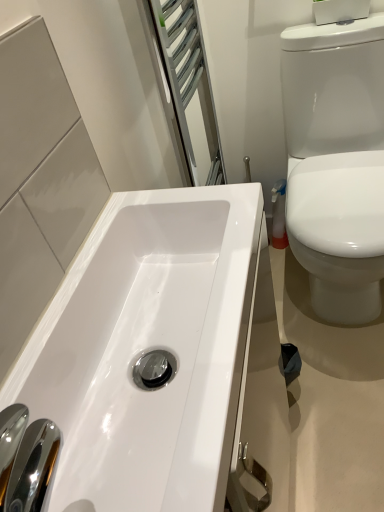
Question: In terms of width, does white glossy toilet at right look wider or thinner when compared to white glossy sink at lower left?

Choices:
 (A) thin
 (B) wide

Answer: (B)

Question: Relative to white glossy sink at lower left, is white glossy toilet at right in front or behind?

Choices:
 (A) front
 (B) behind

Answer: (B)

Question: Looking at the image, does white glossy toilet at right seem bigger or smaller compared to white glossy sink at lower left?

Choices:
 (A) small
 (B) big

Answer: (B)

Question: Is white glossy sink at lower left taller or shorter than white glossy toilet at right?

Choices:
 (A) short
 (B) tall

Answer: (A)

Question: In terms of size, does white glossy sink at lower left appear bigger or smaller than white glossy toilet at right?

Choices:
 (A) small
 (B) big

Answer: (A)

Question: From a real-world perspective, relative to white glossy toilet at right, is white glossy sink at lower left vertically above or below?

Choices:
 (A) below
 (B) above

Answer: (B)

Question: Considering the positions of white glossy sink at lower left and white glossy toilet at right in the image, is white glossy sink at lower left wider or thinner than white glossy toilet at right?

Choices:
 (A) thin
 (B) wide

Answer: (A)